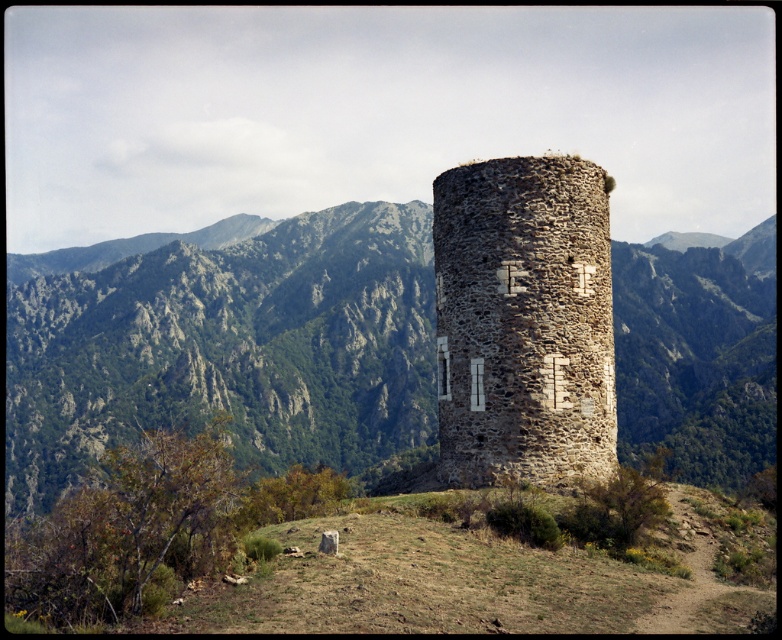
Locate an element on the screen. This screenshot has height=640, width=782. rugged stone tower at center is located at coordinates 230,348.

Image resolution: width=782 pixels, height=640 pixels. What do you see at coordinates (230, 348) in the screenshot?
I see `rugged stone tower at center` at bounding box center [230, 348].

Image resolution: width=782 pixels, height=640 pixels. In order to click on rugged stone tower at center in this screenshot , I will do `click(230, 348)`.